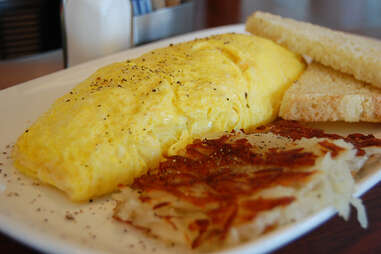
Locate an element on the screen. This screenshot has height=254, width=381. plate is located at coordinates (29, 221).